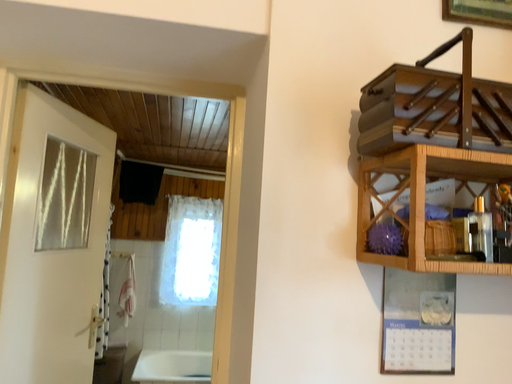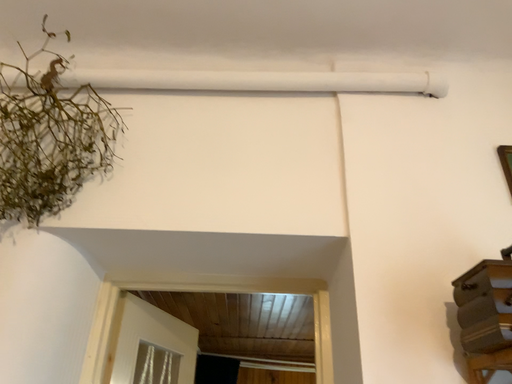
Question: How did the camera likely rotate when shooting the video?

Choices:
 (A) rotated right
 (B) rotated left

Answer: (B)